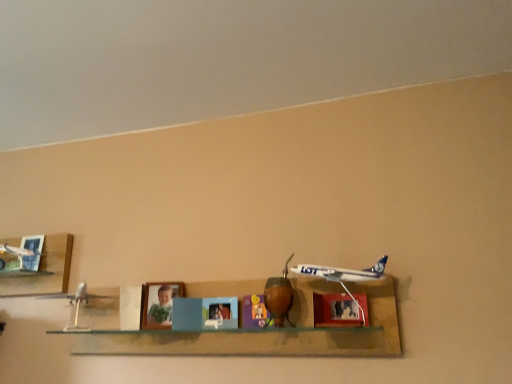
What are the coordinates of `metallic blue airplane at center` in the screenshot? It's located at (344, 275).

What do you see at coordinates (254, 312) in the screenshot?
I see `matte plastic toy at center, which ranks as the second toy in front-to-back order` at bounding box center [254, 312].

The width and height of the screenshot is (512, 384). What do you see at coordinates (256, 330) in the screenshot? I see `white glossy airplane at center, the 1th shelf viewed from the right` at bounding box center [256, 330].

What do you see at coordinates (279, 297) in the screenshot? I see `brown wooden gourd at center, the 1th toy positioned from the front` at bounding box center [279, 297].

The height and width of the screenshot is (384, 512). What do you see at coordinates (336, 311) in the screenshot?
I see `matte wooden picture frame at center, the 2th picture frame viewed from the back` at bounding box center [336, 311].

What is the approximate width of matte wooden picture frame at center, the 2th picture frame viewed from the back?

The width of matte wooden picture frame at center, the 2th picture frame viewed from the back, is 7.38 inches.

The width and height of the screenshot is (512, 384). What are the coordinates of `metallic blue airplane at center` in the screenshot? It's located at (344, 275).

Which object is positioned more to the right, white glossy airplane at center, which is the second shelf in left-to-right order, or matte plastic toy at center, which ranks as the second toy in front-to-back order?

From the viewer's perspective, matte plastic toy at center, which ranks as the second toy in front-to-back order, appears more on the right side.

From the image's perspective, which is below, white glossy airplane at center, which is the second shelf in left-to-right order, or matte plastic toy at center, the 1th toy from the back?

white glossy airplane at center, which is the second shelf in left-to-right order, appears lower in the image.

Which toy is the 1st one when counting from the right side of the white glossy airplane at center, which is the second shelf in left-to-right order? Please provide its 2D coordinates.

[(254, 312)]

Which of these two, white glossy airplane at center, which is the second shelf in left-to-right order, or matte plastic toy at center, which ranks as the second toy in front-to-back order, is bigger?

white glossy airplane at center, which is the second shelf in left-to-right order.

Is brown wooden gourd at center, the 1th toy positioned from the front, not close to matte wooden picture frame at center, which is the first picture frame in front-to-back order?

No, brown wooden gourd at center, the 1th toy positioned from the front, is in close proximity to matte wooden picture frame at center, which is the first picture frame in front-to-back order.

Which object is closer to the camera, brown wooden gourd at center, the 1th toy positioned from the front, or matte wooden picture frame at center, which ranks as the 2th picture frame in left-to-right order?

matte wooden picture frame at center, which ranks as the 2th picture frame in left-to-right order.

Does brown wooden gourd at center, the second toy positioned from the back, have a smaller size compared to matte wooden picture frame at center, the 2th picture frame viewed from the back?

Incorrect, brown wooden gourd at center, the second toy positioned from the back, is not smaller in size than matte wooden picture frame at center, the 2th picture frame viewed from the back.

Does white glossy airplane at center, the 1th shelf viewed from the right, have a smaller size compared to matte wooden picture frame at center, which ranks as the 2th picture frame in left-to-right order?

No.

Who is taller, white glossy airplane at center, which is the second shelf in left-to-right order, or matte wooden picture frame at center, the 2th picture frame viewed from the back?

white glossy airplane at center, which is the second shelf in left-to-right order.

Is white glossy airplane at center, which is the second shelf in left-to-right order, oriented towards matte wooden picture frame at center, arranged as the 1th picture frame when viewed from the right?

Yes, white glossy airplane at center, which is the second shelf in left-to-right order, is oriented towards matte wooden picture frame at center, arranged as the 1th picture frame when viewed from the right.

From a real-world perspective, count 1st picture frames upward from the white glossy airplane at center, which is the second shelf in left-to-right order, and point to it. Please provide its 2D coordinates.

[(336, 311)]

Does matte plastic toy at center, which ranks as the second toy in front-to-back order, have a greater height compared to brushed metal picture frame at upper left, which is counted as the 1th picture frame, starting from the left?

Incorrect, the height of matte plastic toy at center, which ranks as the second toy in front-to-back order, is not larger of that of brushed metal picture frame at upper left, which is counted as the 1th picture frame, starting from the left.

Is brushed metal picture frame at upper left, which is counted as the 1th picture frame, starting from the left, located within matte plastic toy at center, which ranks as the second toy in front-to-back order?

No, brushed metal picture frame at upper left, which is counted as the 1th picture frame, starting from the left, is not inside matte plastic toy at center, which ranks as the second toy in front-to-back order.

From the image's perspective, who appears lower, matte plastic toy at center, the 1th toy from the back, or brushed metal picture frame at upper left, which is counted as the 1th picture frame, starting from the left?

matte plastic toy at center, the 1th toy from the back, is shown below in the image.

Find the location of a particular element. The height and width of the screenshot is (384, 512). toy on the right of the matte plastic toy at center, the 1th toy from the back is located at coordinates point(279,297).

Considering the relative sizes of matte plastic toy at center, the 1th toy from the back, and brown wooden gourd at center, the second toy positioned from the back, in the image provided, is matte plastic toy at center, the 1th toy from the back, smaller than brown wooden gourd at center, the second toy positioned from the back,?

Indeed, matte plastic toy at center, the 1th toy from the back, has a smaller size compared to brown wooden gourd at center, the second toy positioned from the back.

Is point (252, 308) closer to camera compared to point (284, 284)?

No, (252, 308) is behind (284, 284).

Is matte plastic toy at center, the 1th toy from the back, to the left or to the right of brown wooden gourd at center, the 1th toy positioned from the front, in the image?

matte plastic toy at center, the 1th toy from the back, is to the left of brown wooden gourd at center, the 1th toy positioned from the front.

Between brown wooden gourd at center, the 1th toy positioned from the front, and brushed metal airplane at left, which is the second shelf in right-to-left order, which one is positioned behind?

Positioned behind is brushed metal airplane at left, which is the second shelf in right-to-left order.

Is brown wooden gourd at center, the 1th toy positioned from the front, not inside brushed metal airplane at left, which ranks as the first shelf in left-to-right order?

That's correct, brown wooden gourd at center, the 1th toy positioned from the front, is outside of brushed metal airplane at left, which ranks as the first shelf in left-to-right order.

Considering the positions of points (291, 286) and (16, 239), is point (291, 286) closer to camera compared to point (16, 239)?

Yes, point (291, 286) is in front of point (16, 239).

Can you confirm if brushed metal picture frame at upper left, which appears as the 2th picture frame when viewed from the front, is wider than matte plastic toy at center, the 1th toy from the back?

No.

This screenshot has width=512, height=384. I want to click on the 2nd toy below the brushed metal picture frame at upper left, which appears as the 2th picture frame when viewed from the front (from a real-world perspective), so click(254, 312).

Can we say brushed metal picture frame at upper left, the 1th picture frame when ordered from back to front, lies outside matte plastic toy at center, which ranks as the second toy in front-to-back order?

brushed metal picture frame at upper left, the 1th picture frame when ordered from back to front, lies outside matte plastic toy at center, which ranks as the second toy in front-to-back order,'s area.

Does brushed metal picture frame at upper left, which is counted as the 1th picture frame, starting from the left, turn towards matte plastic toy at center, the 1th toy from the back?

No, brushed metal picture frame at upper left, which is counted as the 1th picture frame, starting from the left, is not oriented towards matte plastic toy at center, the 1th toy from the back.

At what (x,y) coordinates should I click in order to perform the action: click on shelf below the matte plastic toy at center, the 1th toy from the back (from the image's perspective). Please return your answer as a coordinate pair (x, y). Looking at the image, I should click on (256, 330).

Where is `toy above the matte wooden picture frame at center, which ranks as the 2th picture frame in left-to-right order (from the image's perspective)`? The height and width of the screenshot is (384, 512). toy above the matte wooden picture frame at center, which ranks as the 2th picture frame in left-to-right order (from the image's perspective) is located at coordinates (279, 297).

Based on their spatial positions, is brushed metal picture frame at upper left, the 1th picture frame when ordered from back to front, or brushed metal airplane at left, which ranks as the first shelf in left-to-right order, closer to brown wooden gourd at center, the second toy positioned from the back?

brushed metal picture frame at upper left, the 1th picture frame when ordered from back to front, is positioned closer to the anchor brown wooden gourd at center, the second toy positioned from the back.

Looking at the image, which one is located closer to metallic blue airplane at center, matte wooden picture frame at center, which is the first picture frame in front-to-back order, or brushed metal picture frame at upper left, which appears as the 2th picture frame when viewed from the front?

matte wooden picture frame at center, which is the first picture frame in front-to-back order.

Which object lies further to the anchor point white glossy airplane at center, which is the second shelf in left-to-right order, brushed metal airplane at left, which ranks as the first shelf in left-to-right order, or matte plastic toy at center, the 1th toy from the back?

brushed metal airplane at left, which ranks as the first shelf in left-to-right order, lies further to white glossy airplane at center, which is the second shelf in left-to-right order, than the other object.

Considering their positions, is white glossy airplane at center, which is the second shelf in left-to-right order, positioned further to brushed metal picture frame at upper left, which appears as the 2th picture frame when viewed from the front, than matte plastic toy at center, which ranks as the second toy in front-to-back order?

matte plastic toy at center, which ranks as the second toy in front-to-back order, lies further to brushed metal picture frame at upper left, which appears as the 2th picture frame when viewed from the front, than the other object.

Looking at the image, which one is located closer to matte plastic toy at center, the 1th toy from the back, matte wooden picture frame at center, which ranks as the 2th picture frame in left-to-right order, or white glossy airplane at center, the 1th shelf viewed from the right?

matte wooden picture frame at center, which ranks as the 2th picture frame in left-to-right order.

Which object lies further to the anchor point metallic blue airplane at center, white glossy airplane at center, which is the second shelf in left-to-right order, or matte wooden picture frame at center, which is the first picture frame in front-to-back order?

white glossy airplane at center, which is the second shelf in left-to-right order.

Looking at the image, which one is located further to brown wooden gourd at center, the 1th toy positioned from the front, brushed metal airplane at left, which is the second shelf in right-to-left order, or metallic blue airplane at center?

The object further to brown wooden gourd at center, the 1th toy positioned from the front, is brushed metal airplane at left, which is the second shelf in right-to-left order.

Looking at the image, which one is located closer to matte plastic toy at center, the 1th toy from the back, matte wooden picture frame at center, the 2th picture frame viewed from the back, or brown wooden gourd at center, the 1th toy positioned from the front?

The object closer to matte plastic toy at center, the 1th toy from the back, is brown wooden gourd at center, the 1th toy positioned from the front.

Find the location of a particular element. The height and width of the screenshot is (384, 512). toy between white glossy airplane at center, which is the second shelf in left-to-right order, and matte plastic toy at center, the 1th toy from the back, from front to back is located at coordinates (279, 297).

I want to click on shelf between brushed metal airplane at left, which is the second shelf in right-to-left order, and matte wooden picture frame at center, which is the first picture frame in front-to-back order, so click(x=256, y=330).

This screenshot has width=512, height=384. I want to click on plane located between brushed metal airplane at left, which is the second shelf in right-to-left order, and matte wooden picture frame at center, arranged as the 1th picture frame when viewed from the right, in the left-right direction, so click(x=344, y=275).

Locate an element on the screen. This screenshot has height=384, width=512. toy located between matte plastic toy at center, the 1th toy from the back, and matte wooden picture frame at center, arranged as the 1th picture frame when viewed from the right, in the left-right direction is located at coordinates (279, 297).